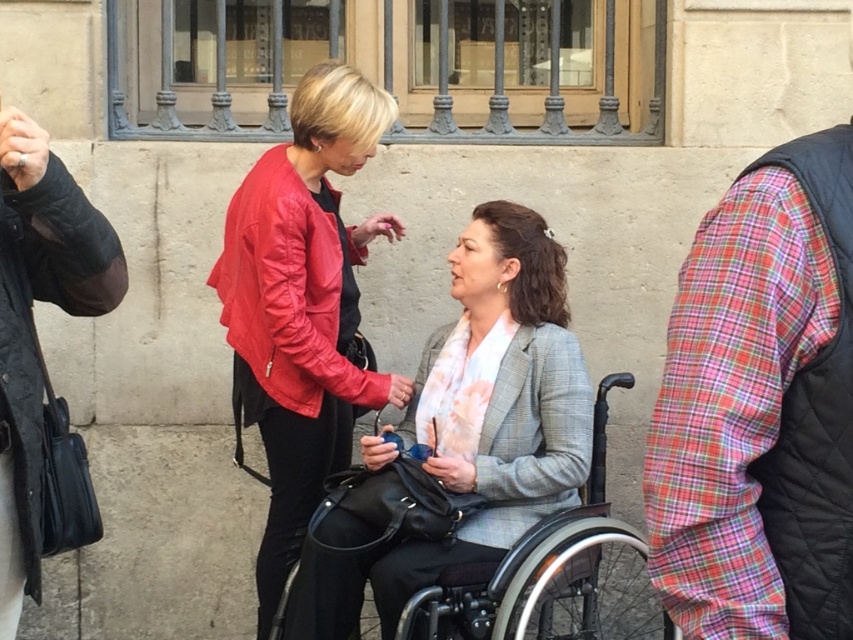
Who is higher up, plaid fabric sleeve at right or black quilted jacket at left?

plaid fabric sleeve at right is above.

Does plaid fabric sleeve at right have a greater height compared to black quilted jacket at left?

In fact, plaid fabric sleeve at right may be shorter than black quilted jacket at left.

Who is more forward, (x=839, y=188) or (x=0, y=467)?

Point (x=839, y=188)

Where is `plaid fabric sleeve at right`? plaid fabric sleeve at right is located at coordinates (759, 406).

Who is shorter, black quilted jacket at left or black plastic wheelchair at center?

Standing shorter between the two is black plastic wheelchair at center.

Is point (4, 310) closer to viewer compared to point (410, 506)?

Yes, it is in front of point (410, 506).

This screenshot has height=640, width=853. I want to click on black quilted jacket at left, so click(30, 326).

How much distance is there between plaid fabric sleeve at right and black plastic wheelchair at center?

plaid fabric sleeve at right is 6.32 feet away from black plastic wheelchair at center.

Find the location of `plaid fabric sleeve at right`. plaid fabric sleeve at right is located at coordinates (x=759, y=406).